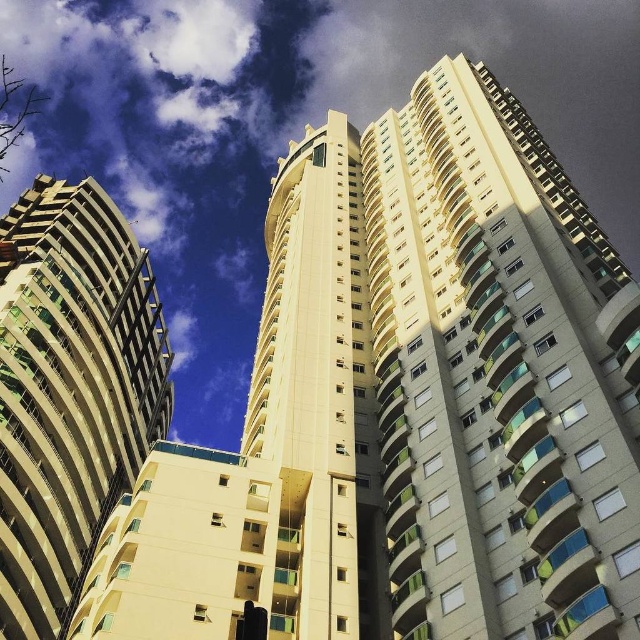
You are standing at the base of the high rise buildings and want to look at two points in the scene. The first is point [124,324] and the second is point [276,385]. Which point is closer to you?

Point [124,324] is closer to you because it is further to the viewer than point [276,385].

You are standing at the base of the buildings in the image. Which building would appear larger to you, the matte yellow building at upper right or the beige concrete building at left?

The matte yellow building at upper right would appear larger because it is closer to the viewer than the beige concrete building at left.